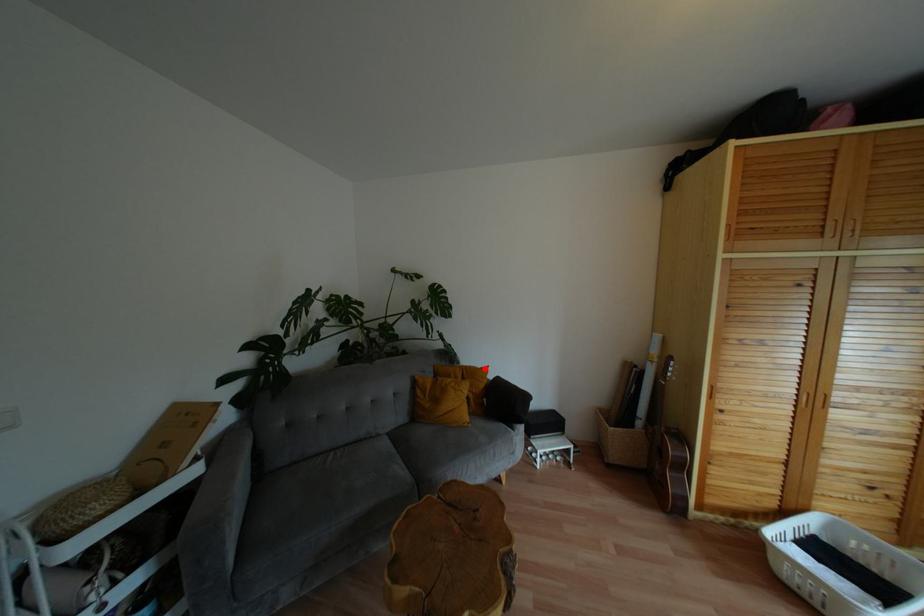
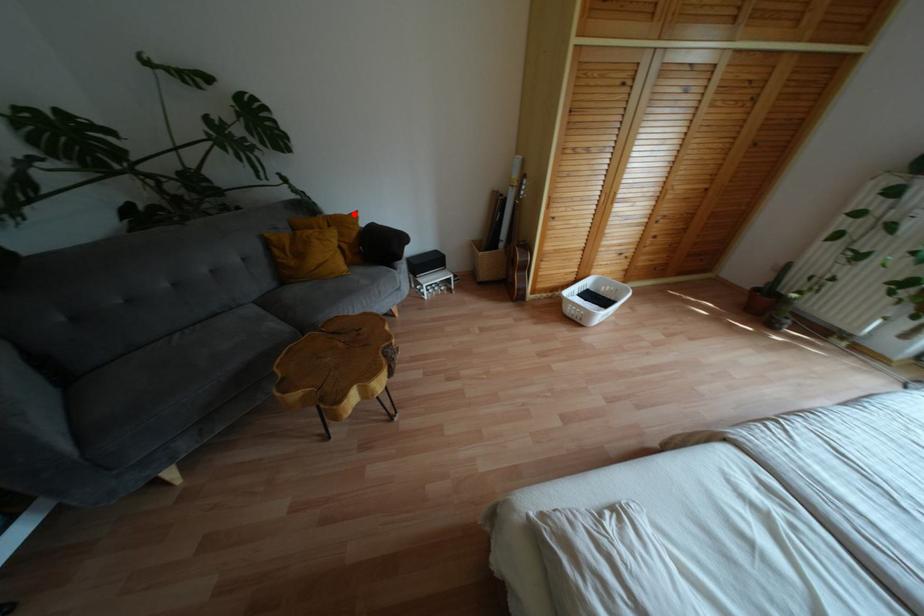
I am providing you with two images of the same scene from different viewpoints. A red point is marked on the first image and another point is marked on the second image. Is the marked point in image1 the same physical position as the marked point in image2?

Yes